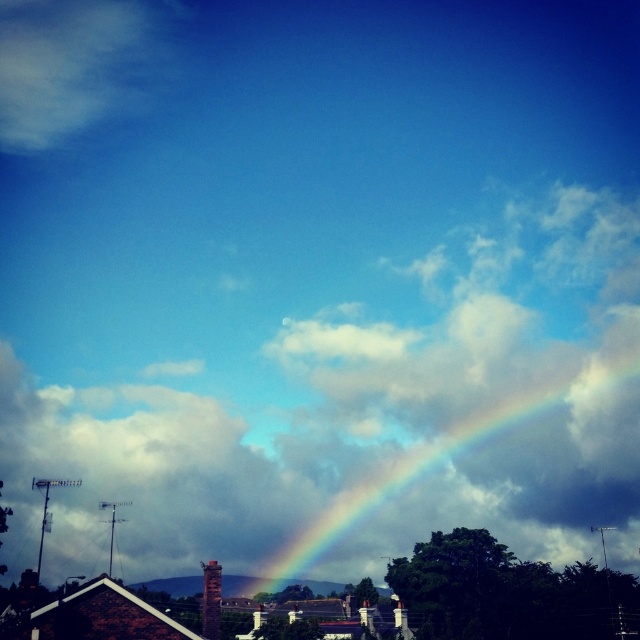
Question: Which object is positioned farthest from the white fluffy cloud at upper left?

Choices:
 (A) rainbow at center
 (B) cloudy sky at upper center

Answer: (A)

Question: Is cloudy sky at upper center in front of rainbow at center?

Choices:
 (A) no
 (B) yes

Answer: (B)

Question: Is cloudy sky at upper center closer to camera compared to rainbow at center?

Choices:
 (A) yes
 (B) no

Answer: (A)

Question: Which object is the closest to the cloudy sky at upper center?

Choices:
 (A) rainbow at center
 (B) white fluffy cloud at upper left

Answer: (A)

Question: Which object is farther from the camera taking this photo?

Choices:
 (A) cloudy sky at upper center
 (B) rainbow at center
 (C) white fluffy cloud at upper left

Answer: (C)

Question: Can you confirm if white fluffy cloud at upper left is positioned below rainbow at center?

Choices:
 (A) yes
 (B) no

Answer: (B)